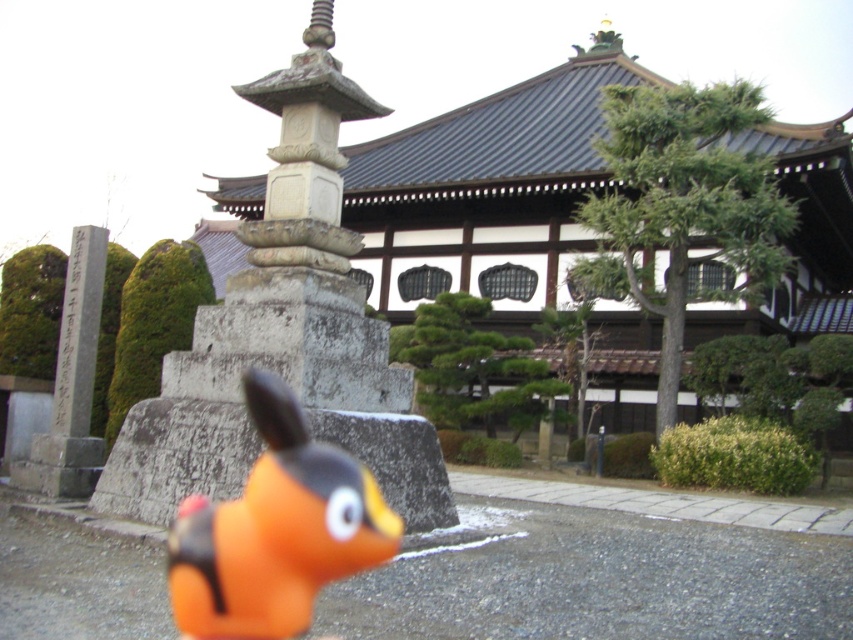
Who is more forward, (x=178, y=540) or (x=62, y=419)?

Positioned in front is point (x=178, y=540).

Does orange matte toy at center have a greater width compared to gray stone monument at left?

Yes.

At what (x,y) coordinates should I click in order to perform the action: click on orange matte toy at center. Please return your answer as a coordinate pair (x, y). This screenshot has height=640, width=853. Looking at the image, I should click on (276, 529).

Locate an element on the screen. The height and width of the screenshot is (640, 853). orange matte toy at center is located at coordinates (276, 529).